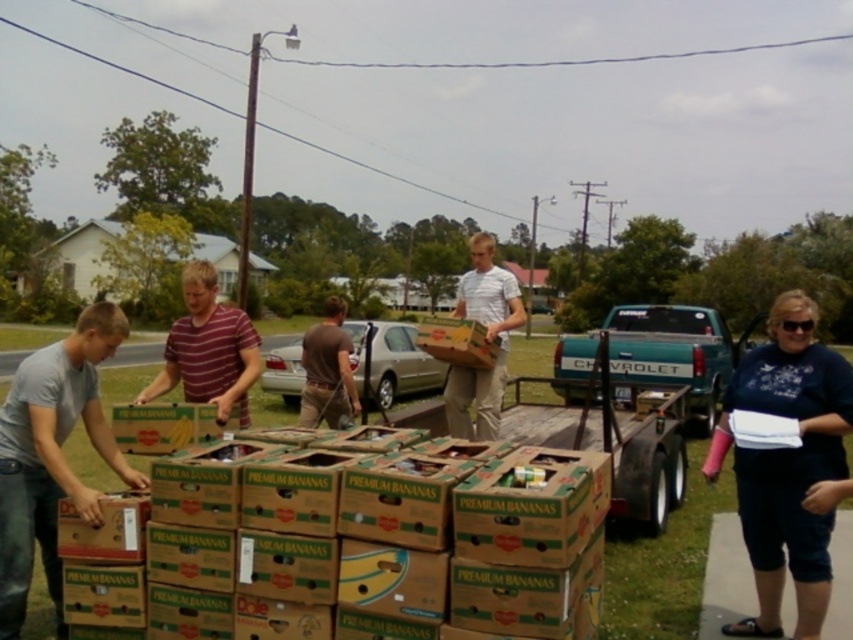
Can you confirm if teal metallic truck at center is bigger than white matte shirt at center?

Correct, teal metallic truck at center is larger in size than white matte shirt at center.

The width and height of the screenshot is (853, 640). What do you see at coordinates (676, 353) in the screenshot?
I see `teal metallic truck at center` at bounding box center [676, 353].

Locate an element on the screen. Image resolution: width=853 pixels, height=640 pixels. teal metallic truck at center is located at coordinates (676, 353).

Does white cotton shirt at lower right lie in front of brown cotton shirt at center?

Yes.

Is point (799, 557) more distant than point (338, 346)?

No.

The height and width of the screenshot is (640, 853). What do you see at coordinates (785, 461) in the screenshot? I see `white cotton shirt at lower right` at bounding box center [785, 461].

This screenshot has width=853, height=640. Find the location of `white cotton shirt at lower right`. white cotton shirt at lower right is located at coordinates (785, 461).

Which is more to the left, green cardboard box at lower left or brown cardboard box at center?

green cardboard box at lower left

What do you see at coordinates (166, 426) in the screenshot? Image resolution: width=853 pixels, height=640 pixels. I see `green cardboard box at lower left` at bounding box center [166, 426].

Locate an element on the screen. The height and width of the screenshot is (640, 853). green cardboard box at lower left is located at coordinates (166, 426).